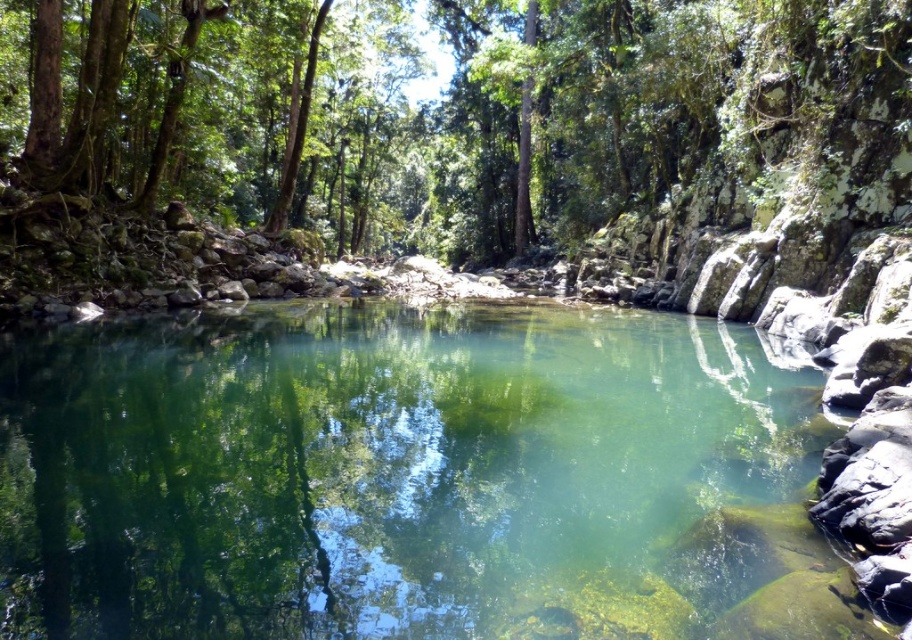
You are standing on the bank of the river and want to take a photo of both the clear glassy water at center and the green leafy tree at center. Which object should you focus on first if you want to capture both in one shot without moving the camera?

You should focus on the green leafy tree at center first because it is taller than the clear glassy water at center, so adjusting the focus to the tree will ensure both are in the frame.